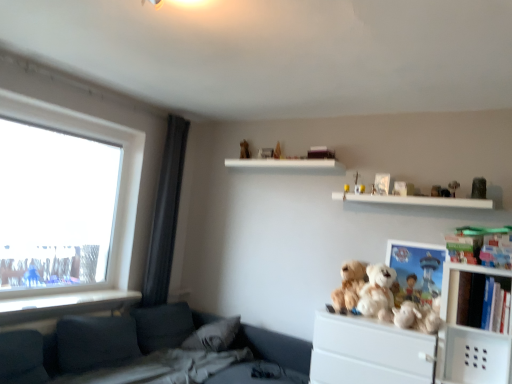
Locate an element on the screen. This screenshot has width=512, height=384. empty space that is ontop of matte plastic picture frame at center-right is located at coordinates (421, 240).